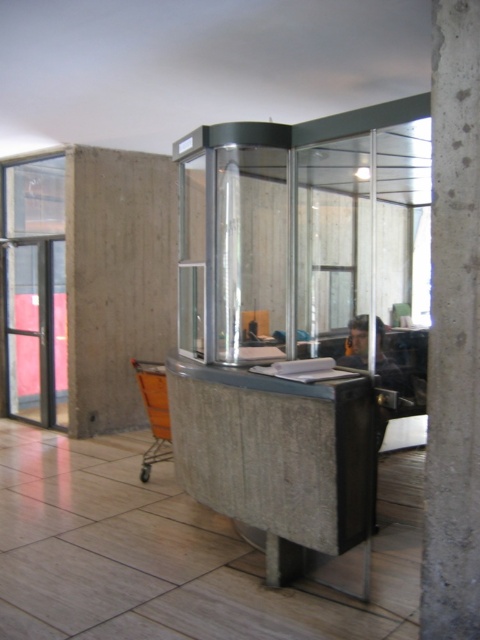
Does concrete pillar at center-right appear on the right side of orange mesh shopping cart at lower left?

Yes, concrete pillar at center-right is to the right of orange mesh shopping cart at lower left.

Who is taller, concrete pillar at center-right or orange mesh shopping cart at lower left?

Standing taller between the two is concrete pillar at center-right.

Does point (478, 344) lie in front of point (158, 369)?

That is True.

The image size is (480, 640). Identify the location of concrete pillar at center-right. [x=453, y=332].

Describe the element at coordinates (36, 332) in the screenshot. I see `transparent glass door at left` at that location.

Does transparent glass door at left lie behind orange mesh shopping cart at lower left?

Yes, transparent glass door at left is further from the viewer.

Is point (60, 282) farther from viewer compared to point (144, 472)?

Yes, point (60, 282) is farther from viewer.

Locate an element on the screen. This screenshot has width=480, height=640. transparent glass door at left is located at coordinates (36, 332).

Identify the location of concrete pillar at center-right. Image resolution: width=480 pixels, height=640 pixels. (453, 332).

Measure the distance between point (430, 490) and camera.

Point (430, 490) is 2.39 meters from camera.

Find the location of `concrete pillar at center-right`. concrete pillar at center-right is located at coordinates (453, 332).